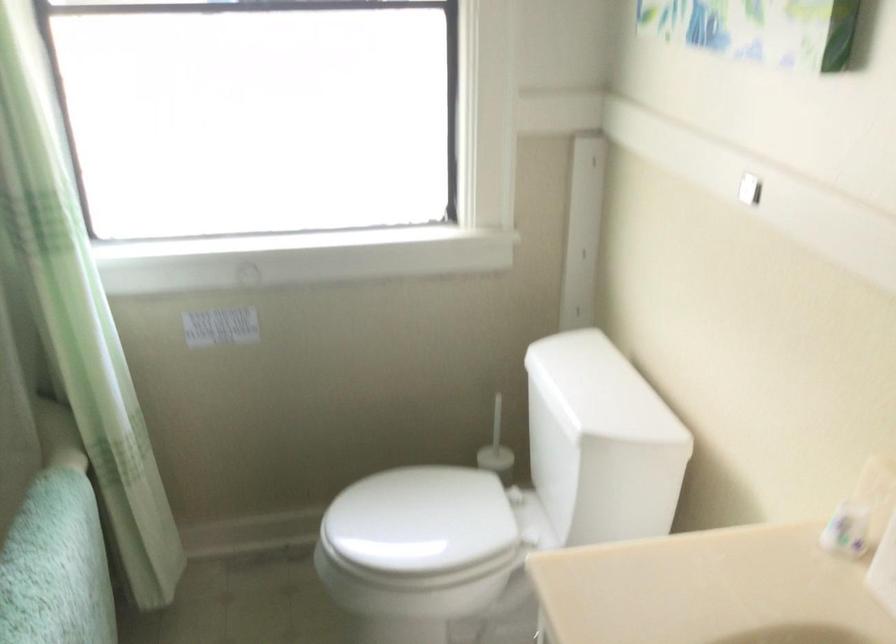
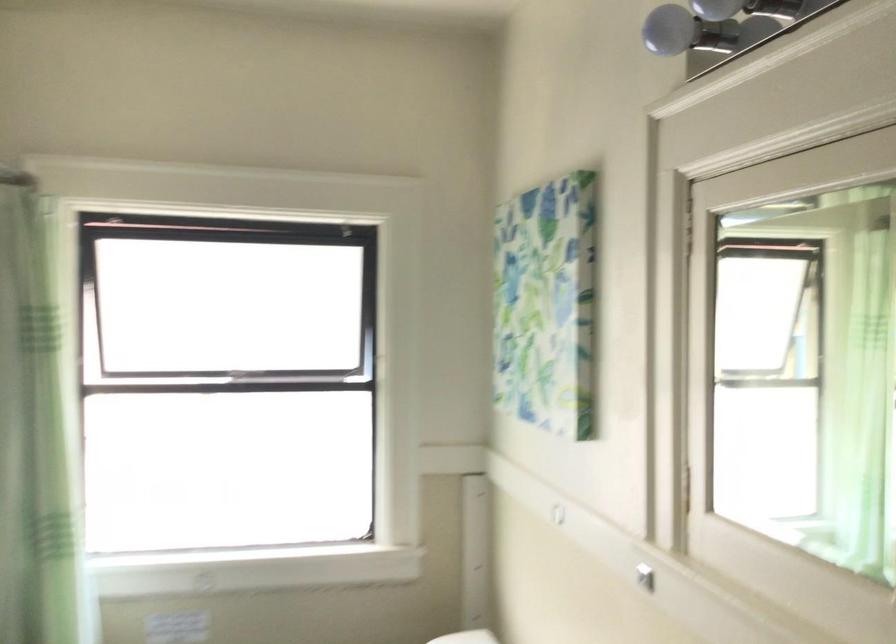
Question: The images are taken continuously from a first-person perspective. In which direction are you moving?

Choices:
 (A) Left
 (B) Right
 (C) Forward
 (D) Backward

Answer: (D)